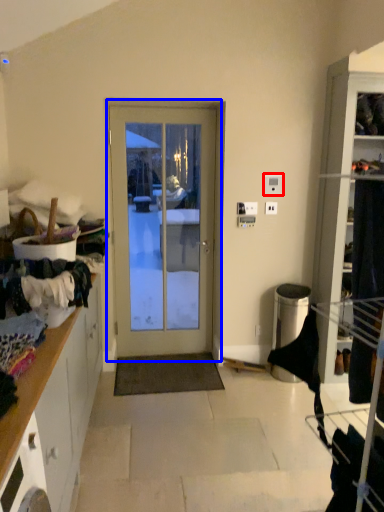
Question: Which object appears farthest to the camera in this image, light switch (highlighted by a red box) or door (highlighted by a blue box)?

Choices:
 (A) light switch
 (B) door

Answer: (A)